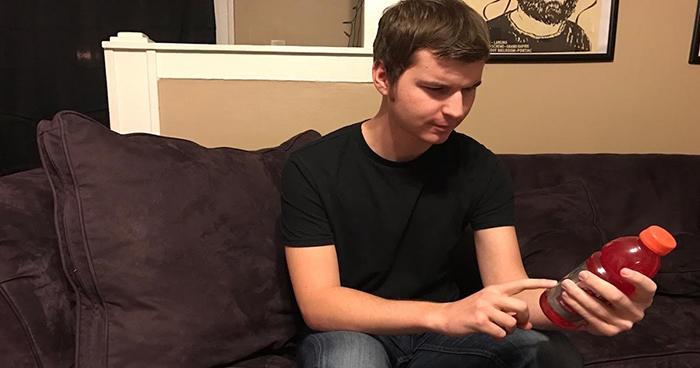
At what (x,y) coordinates should I click in order to perform the action: click on man sitting on sofa. Please return your answer as a coordinate pair (x, y). Looking at the image, I should click on (425, 222).